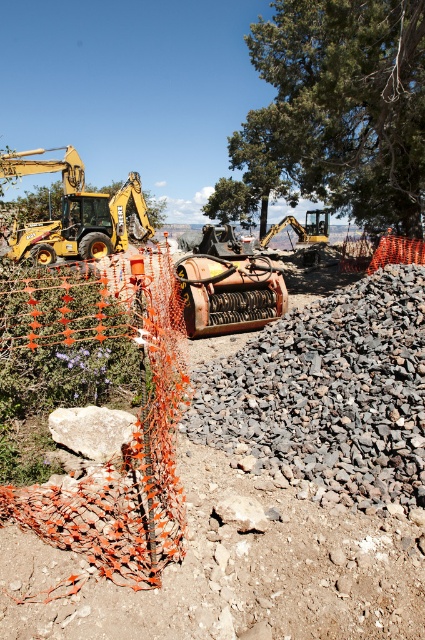
Is orange mesh fence at center-left to the right of yellow rubber excavator at upper left from the viewer's perspective?

Indeed, orange mesh fence at center-left is positioned on the right side of yellow rubber excavator at upper left.

Is orange mesh fence at center-left bigger than yellow rubber excavator at upper left?

Incorrect, orange mesh fence at center-left is not larger than yellow rubber excavator at upper left.

Identify the location of orange mesh fence at center-left. The height and width of the screenshot is (640, 425). (277, 490).

Where is `orange mesh fence at center-left`? This screenshot has width=425, height=640. orange mesh fence at center-left is located at coordinates (277, 490).

Can you confirm if green leafy tree at upper center is shorter than yellow metal excavator at left?

In fact, green leafy tree at upper center may be taller than yellow metal excavator at left.

The width and height of the screenshot is (425, 640). I want to click on green leafy tree at upper center, so click(340, 108).

The width and height of the screenshot is (425, 640). I want to click on green leafy tree at upper center, so click(340, 108).

Who is shorter, orange mesh fence at center-left or green leafy tree at upper center?

Standing shorter between the two is orange mesh fence at center-left.

Between point (192, 630) and point (265, 48), which one is positioned in front?

Point (192, 630) is more forward.

Measure the distance between point (371, 576) and camera.

They are 2.96 meters apart.

The height and width of the screenshot is (640, 425). What are the coordinates of `orange mesh fence at center-left` in the screenshot? It's located at (277, 490).